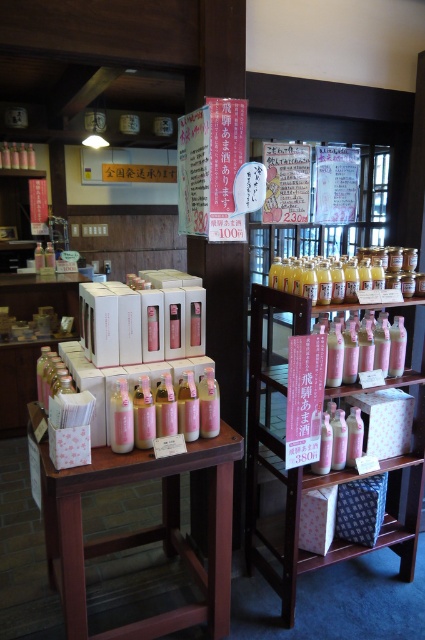
Looking at this image, you are standing in the traditional Japanese shop and want to buy some amazake. Where is the wooden table at center located in relation to the other items?

The wooden table at center is located at point 0.830 on the x axis and 0.336 on the y axis.